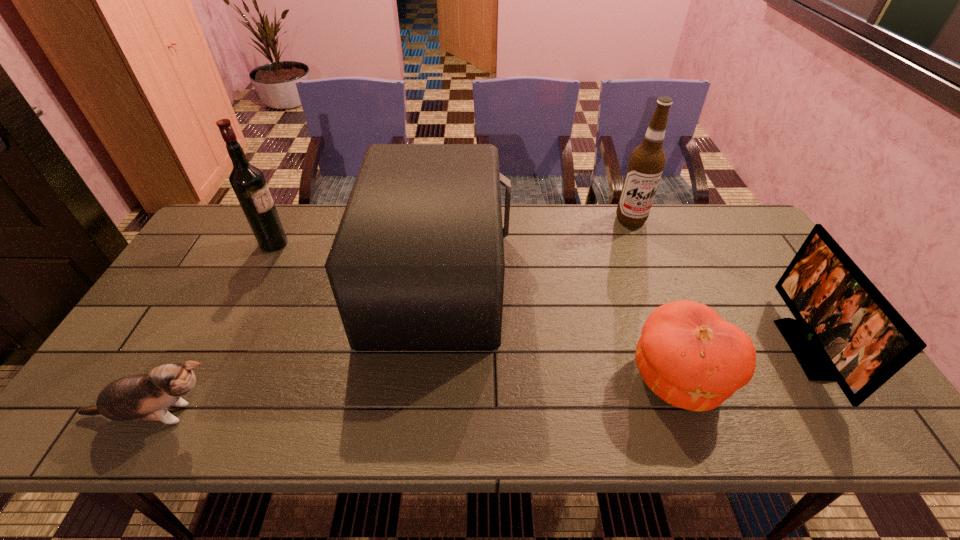
Identify the location of object that is at the left edge. This screenshot has width=960, height=540. (146, 397).

Image resolution: width=960 pixels, height=540 pixels. I want to click on object that is at the right edge, so (x=845, y=330).

This screenshot has height=540, width=960. What are the coordinates of `object that is at the near left corner` in the screenshot? It's located at (146, 397).

Identify the location of object at the near right corner. The width and height of the screenshot is (960, 540). (845, 330).

This screenshot has width=960, height=540. In order to click on free space at the far edge of the desktop in this screenshot , I will do `click(519, 234)`.

The width and height of the screenshot is (960, 540). In order to click on vacant space at the near edge of the desktop in this screenshot , I will do `click(525, 434)`.

Identify the location of free region at the left edge. (167, 325).

You are a GUI agent. You are given a task and a screenshot of the screen. Output one action in this format:
    pyautogui.click(x=<x>, y=<y>)
    Task: Click on the free space at the right edge of the desktop
    
    Given the screenshot: What is the action you would take?
    pos(729,279)

Identify the location of free spot at the far left corner of the desktop. (239, 249).

Find the location of a particular element. vacant space at the far right corner of the desktop is located at coordinates (748, 238).